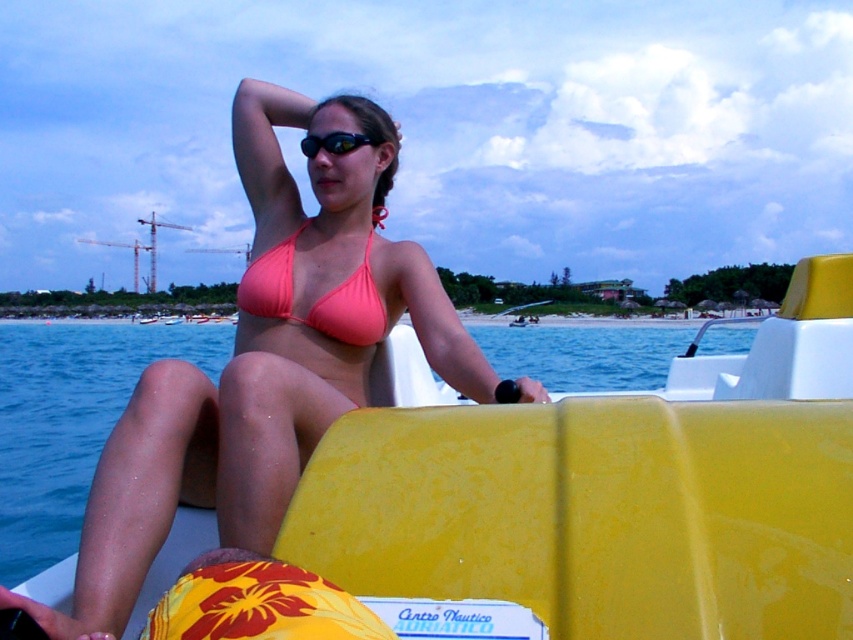
Question: In this image, where is yellow plastic boat at center located relative to black rubber goggles at upper center?

Choices:
 (A) right
 (B) left

Answer: (A)

Question: Where is pink matte bikini top at center located in relation to black rubber goggles at upper center in the image?

Choices:
 (A) below
 (B) above

Answer: (A)

Question: Which of the following is the farthest from the observer?

Choices:
 (A) (405, 337)
 (B) (316, 154)

Answer: (A)

Question: Is yellow plastic boat at center positioned in front of pink matte bikini at center?

Choices:
 (A) no
 (B) yes

Answer: (B)

Question: Which object is the closest to the pink matte bikini at center?

Choices:
 (A) pink matte bikini top at center
 (B) black rubber goggles at upper center
 (C) yellow plastic boat at center

Answer: (B)

Question: Which of the following is the closest to the observer?

Choices:
 (A) pink matte bikini at center
 (B) pink matte bikini top at center

Answer: (B)